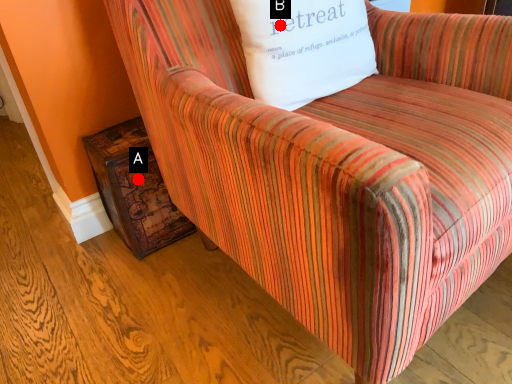
Question: Two points are circled on the image, labeled by A and B beside each circle. Which of the following is the farthest from the observer?

Choices:
 (A) A is further
 (B) B is further

Answer: (A)